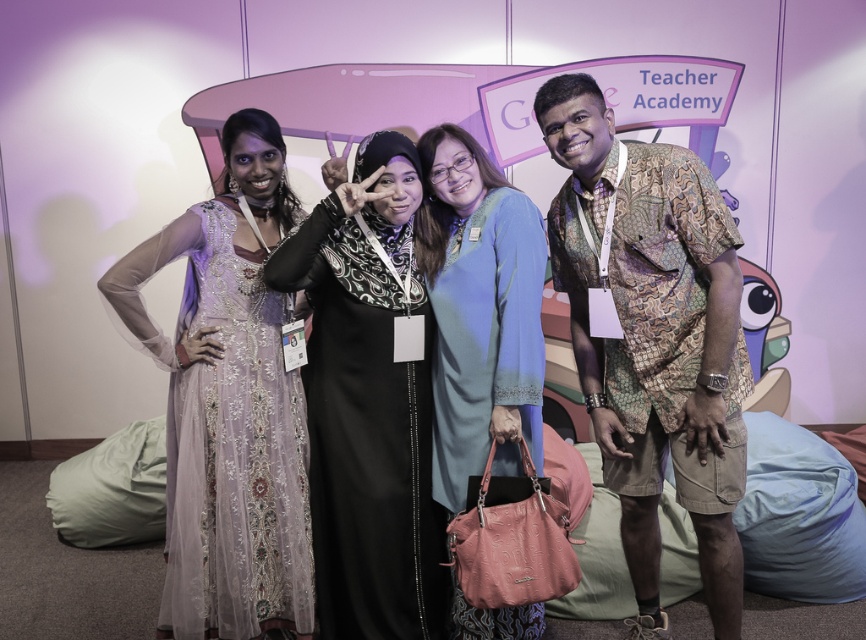
Question: Is lavender sheer dress at left behind black satin dress at center?

Choices:
 (A) no
 (B) yes

Answer: (B)

Question: Which point is closer to the camera?

Choices:
 (A) (380, 595)
 (B) (548, 218)
 (C) (512, 426)
 (D) (276, 228)

Answer: (C)

Question: Which object appears farthest from the camera in this image?

Choices:
 (A) lavender sheer dress at left
 (B) blue satin dress at center

Answer: (A)

Question: Does batik shirt at right appear on the right side of lavender sheer dress at left?

Choices:
 (A) yes
 (B) no

Answer: (A)

Question: Among these objects, which one is nearest to the camera?

Choices:
 (A) lavender sheer dress at left
 (B) blue satin dress at center
 (C) black satin dress at center
 (D) batik shirt at right

Answer: (D)

Question: Can you confirm if batik shirt at right is positioned above lavender sheer dress at left?

Choices:
 (A) yes
 (B) no

Answer: (A)